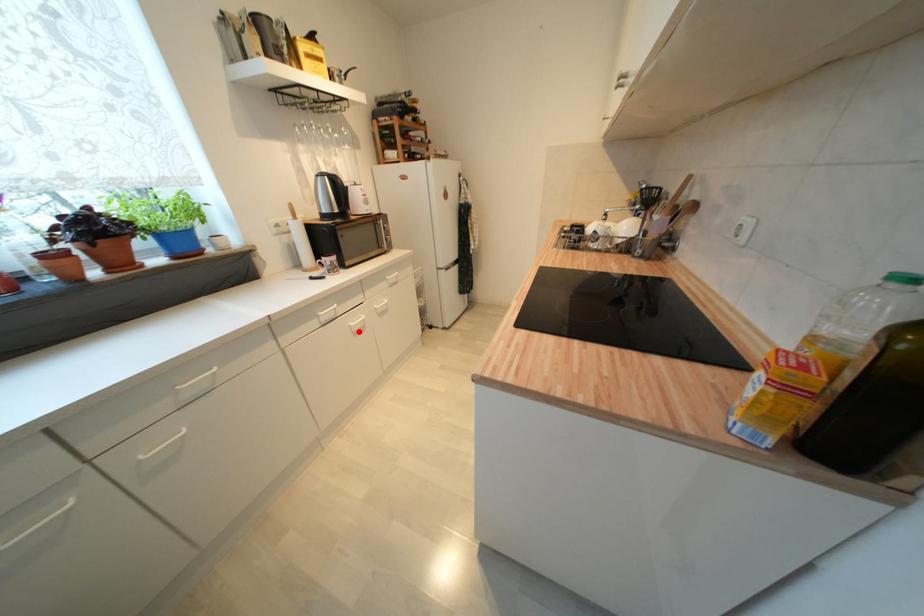
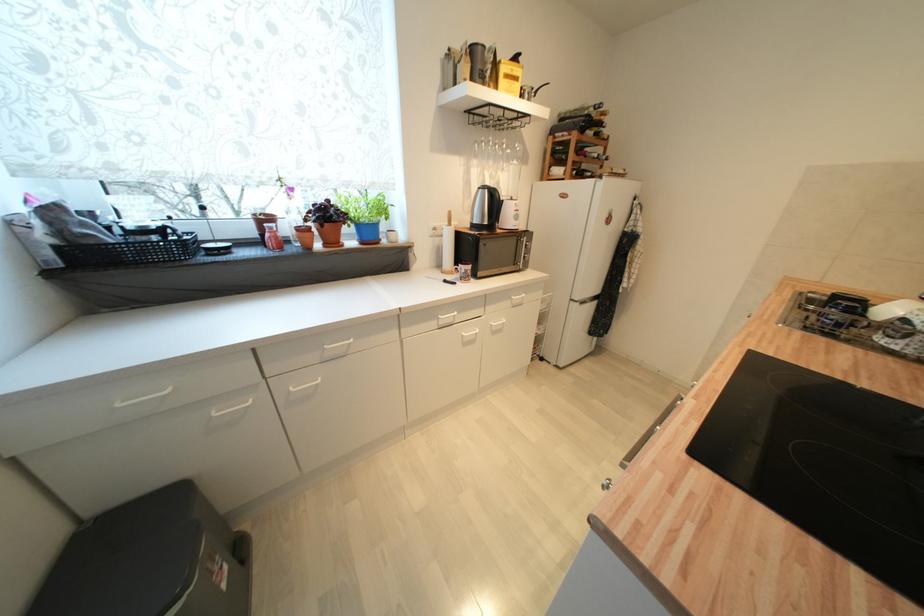
Locate, in the second image, the point that corresponds to the highlighted location in the first image.

(469, 342)